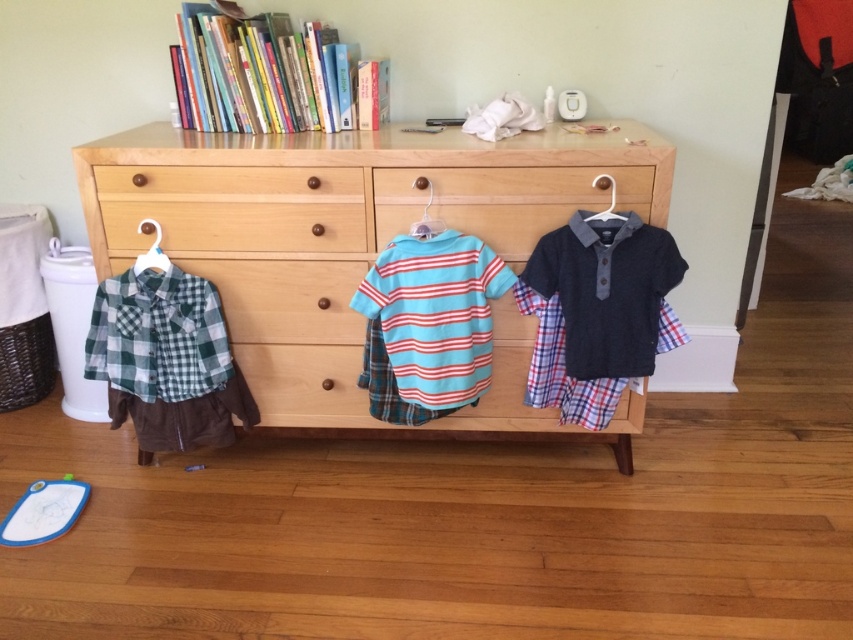
Based on the photo, you are organizing a closet and need to know the distance between the wooden dresser at center and the dark blue textured polo shirt at center. Is it more than 20 centimeters?

The wooden dresser at center is 24.53 centimeters from dark blue textured polo shirt at center, so yes, the distance is more than 20 centimeters.